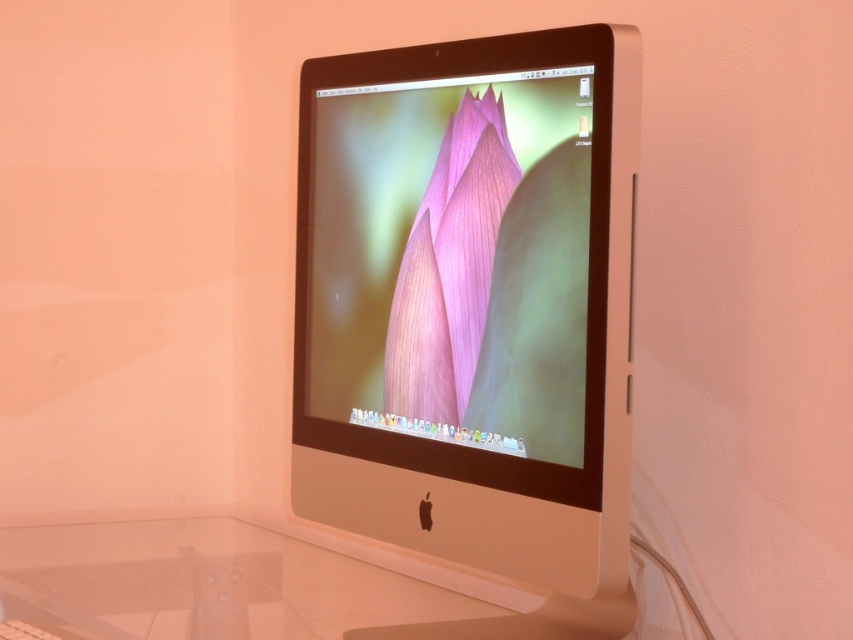
Is satin gold desktop at center wider than pink matte flower at center?

Indeed, satin gold desktop at center has a greater width compared to pink matte flower at center.

Can you confirm if satin gold desktop at center is positioned above pink matte flower at center?

Incorrect, satin gold desktop at center is not positioned above pink matte flower at center.

Is point (271, 632) more distant than point (408, 365)?

That is True.

I want to click on satin gold desktop at center, so click(x=256, y=588).

Does satin white monitor at center appear under pink matte flower at center?

Correct, satin white monitor at center is located below pink matte flower at center.

Does point (560, 164) come behind point (413, 323)?

No, (560, 164) is in front of (413, 323).

Is point (480, 376) closer to camera compared to point (454, 381)?

Yes, it is in front of point (454, 381).

Where is `satin white monitor at center`? The height and width of the screenshot is (640, 853). satin white monitor at center is located at coordinates (473, 314).

Between satin white monitor at center and satin gold desktop at center, which one is positioned lower?

satin gold desktop at center is below.

Between point (596, 232) and point (654, 630), which one is positioned in front?

Point (596, 232)

Identify the location of satin white monitor at center. (473, 314).